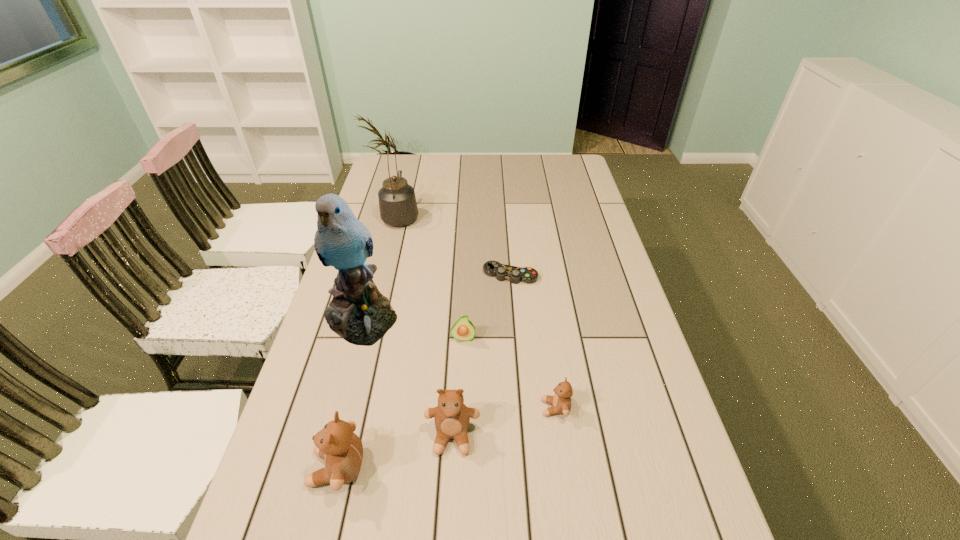
This screenshot has width=960, height=540. Identify the location of object that can be found as the sixth closest to the avocado. tap(397, 202).

Choose which teddy bear is the nearest neighbor to the kettle. Please provide its 2D coordinates. Your answer should be formatted as a tuple, i.e. [(x, y)], where the tuple contains the x and y coordinates of a point satisfying the conditions above.

[(452, 417)]

Locate an element on the screen. This screenshot has width=960, height=540. teddy bear that is the second closest one to the second teddy bear from left to right is located at coordinates (561, 401).

Where is `vacant position in the image that satisfies the following two spatial constraints: 1. on the front-facing side of the second teddy bear from right to left; 2. on the front-facing side of the leftmost teddy bear`? The height and width of the screenshot is (540, 960). vacant position in the image that satisfies the following two spatial constraints: 1. on the front-facing side of the second teddy bear from right to left; 2. on the front-facing side of the leftmost teddy bear is located at coordinates tap(451, 468).

Where is `free point that satisfies the following two spatial constraints: 1. on the front-facing side of the rightmost teddy bear; 2. on the front-facing side of the fourth tallest object`? free point that satisfies the following two spatial constraints: 1. on the front-facing side of the rightmost teddy bear; 2. on the front-facing side of the fourth tallest object is located at coordinates (560, 436).